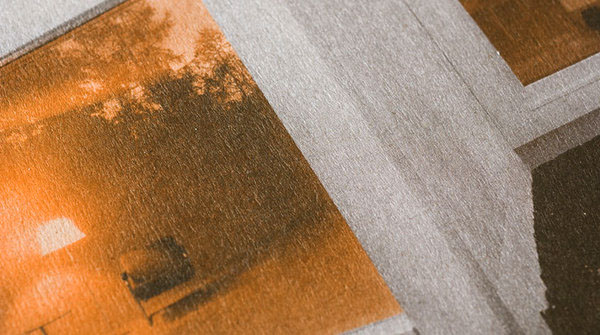
In order to click on floor in this screenshot , I will do `click(314, 288)`.